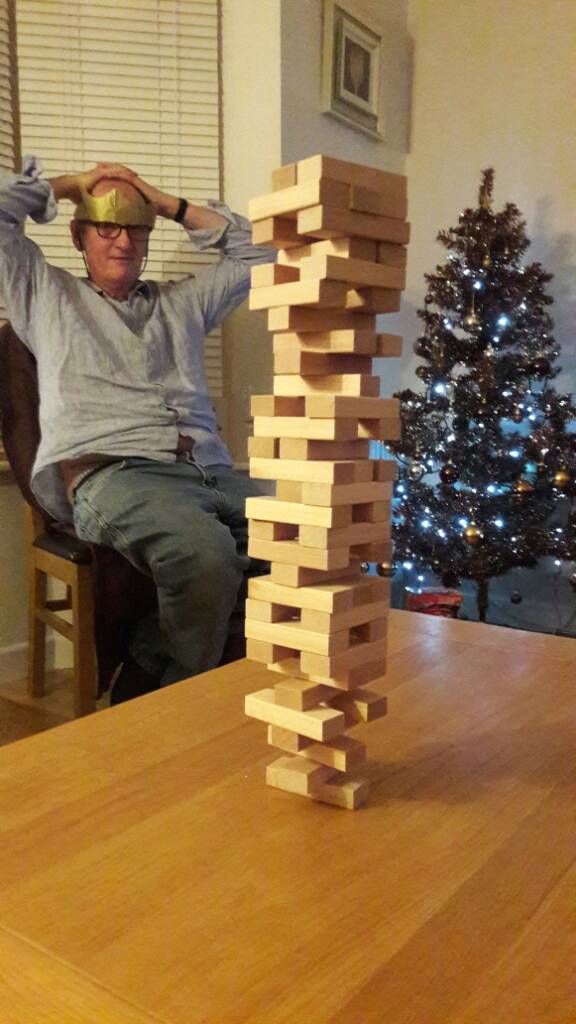
The image size is (576, 1024). What are the coordinates of `table` in the screenshot? It's located at (378, 899).